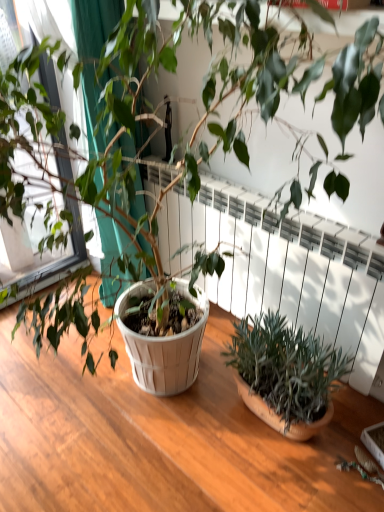
Question: Can you confirm if white textured radiator at center is wider than green fabric at left?

Choices:
 (A) yes
 (B) no

Answer: (B)

Question: From the image's perspective, is white textured radiator at center above green fabric at left?

Choices:
 (A) no
 (B) yes

Answer: (A)

Question: Is white textured radiator at center at the left side of green fabric at left?

Choices:
 (A) yes
 (B) no

Answer: (B)

Question: Is white textured radiator at center bigger than green fabric at left?

Choices:
 (A) no
 (B) yes

Answer: (A)

Question: Considering the relative sizes of white textured radiator at center and green fabric at left in the image provided, is white textured radiator at center shorter than green fabric at left?

Choices:
 (A) no
 (B) yes

Answer: (B)

Question: Is white textured radiator at center thinner than green fabric at left?

Choices:
 (A) no
 (B) yes

Answer: (B)

Question: Considering the relative positions of white textured radiator at center and green matte plant at lower right in the image provided, is white textured radiator at center behind green matte plant at lower right?

Choices:
 (A) no
 (B) yes

Answer: (B)

Question: Is white textured radiator at center positioned in front of green matte plant at lower right?

Choices:
 (A) yes
 (B) no

Answer: (B)

Question: Could you tell me if white textured radiator at center is turned towards green matte plant at lower right?

Choices:
 (A) yes
 (B) no

Answer: (A)

Question: Are white textured radiator at center and green matte plant at lower right located far from each other?

Choices:
 (A) no
 (B) yes

Answer: (A)

Question: From the image's perspective, is white textured radiator at center on green matte plant at lower right?

Choices:
 (A) no
 (B) yes

Answer: (B)

Question: Can you confirm if white textured radiator at center is wider than green matte plant at lower right?

Choices:
 (A) no
 (B) yes

Answer: (A)

Question: Does green fabric at left come in front of green matte plant at lower right?

Choices:
 (A) yes
 (B) no

Answer: (B)